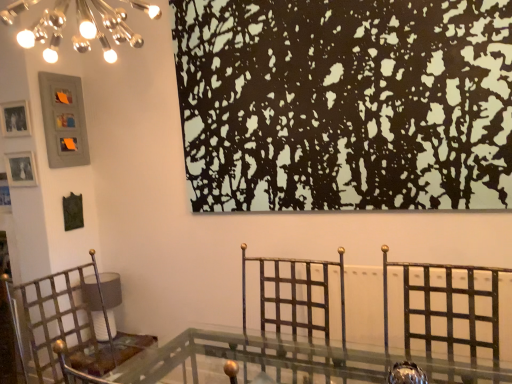
In order to face matte silver picture frame at upper left, the 2th picture frame positioned from the top, should I rotate leftwards or rightwards?

You should look left and rotate roughly 29.496 degrees.

The image size is (512, 384). Describe the element at coordinates (345, 104) in the screenshot. I see `black matte painting at upper center` at that location.

The height and width of the screenshot is (384, 512). Find the location of `metallic gold swivel chair at center`. metallic gold swivel chair at center is located at coordinates (295, 293).

The height and width of the screenshot is (384, 512). I want to click on matte silver picture frame at upper left, the 2th picture frame positioned from the top, so click(x=15, y=119).

I want to click on the 1st picture frame positioned above the matte silver picture frame at left, the third picture frame in the top-to-bottom sequence (from a real-world perspective), so click(64, 120).

Is the position of matte gray picture frame at upper left, marked as the first picture frame in a top-to-bottom arrangement, less distant than that of matte silver picture frame at left, the third picture frame in the top-to-bottom sequence?

No, matte gray picture frame at upper left, marked as the first picture frame in a top-to-bottom arrangement, is further to the viewer.

Between matte gray picture frame at upper left, the 3th picture frame in the bottom-to-top sequence, and matte silver picture frame at left, the 1th picture frame ordered from the bottom, which one appears on the right side from the viewer's perspective?

From the viewer's perspective, matte gray picture frame at upper left, the 3th picture frame in the bottom-to-top sequence, appears more on the right side.

Is matte silver picture frame at upper left, the 2th picture frame positioned from the top, a part of metallic gold swivel chair at center?

Definitely not — matte silver picture frame at upper left, the 2th picture frame positioned from the top, is not inside metallic gold swivel chair at center.

Is metallic gold swivel chair at center touching matte silver picture frame at upper left, which ranks as the second picture frame in bottom-to-top order?

No.

Does point (320, 304) come behind point (8, 113)?

That is False.

Is metallic gold swivel chair at center with black matte painting at upper center?

There is a gap between metallic gold swivel chair at center and black matte painting at upper center.

Is metallic gold swivel chair at center facing away from black matte painting at upper center?

No, metallic gold swivel chair at center is not facing away from black matte painting at upper center.

From their relative heights in the image, would you say metallic gold swivel chair at center is taller or shorter than black matte painting at upper center?

Clearly, metallic gold swivel chair at center is shorter compared to black matte painting at upper center.

How much distance is there between metallic gold swivel chair at center and black matte painting at upper center?

A distance of 30.63 inches exists between metallic gold swivel chair at center and black matte painting at upper center.

Is point (208, 14) in front of point (327, 342)?

No, (208, 14) is further to viewer.

Locate an element on the screen. This screenshot has height=384, width=512. tree above the metallic gold swivel chair at center (from a real-world perspective) is located at coordinates (345, 104).

From the picture: Which object is closer to the camera taking this photo, black matte painting at upper center or metallic gold swivel chair at center?

Positioned in front is metallic gold swivel chair at center.

From a real-world perspective, which is physically above, matte gray picture frame at upper left, the 3th picture frame in the bottom-to-top sequence, or metallic/golden chair at left?

From a 3D spatial view, matte gray picture frame at upper left, the 3th picture frame in the bottom-to-top sequence, is above.

Which is in front, point (80, 104) or point (93, 337)?

Point (93, 337)

From the picture: From the image's perspective, which one is positioned lower, matte gray picture frame at upper left, the 3th picture frame in the bottom-to-top sequence, or metallic/golden chair at left?

metallic/golden chair at left appears lower in the image.

How many degrees apart are the facing directions of matte gray picture frame at upper left, the 3th picture frame in the bottom-to-top sequence, and metallic/golden chair at left?

The facing directions of matte gray picture frame at upper left, the 3th picture frame in the bottom-to-top sequence, and metallic/golden chair at left are 96.3 degrees apart.

Consider the image. Is the surface of matte silver picture frame at upper left, the 2th picture frame positioned from the top, in direct contact with black matte painting at upper center?

No.

Considering the sizes of matte silver picture frame at upper left, which ranks as the second picture frame in bottom-to-top order, and black matte painting at upper center in the image, is matte silver picture frame at upper left, which ranks as the second picture frame in bottom-to-top order, wider or thinner than black matte painting at upper center?

In the image, matte silver picture frame at upper left, which ranks as the second picture frame in bottom-to-top order, appears to be more narrow than black matte painting at upper center.

Relative to black matte painting at upper center, is matte silver picture frame at upper left, which ranks as the second picture frame in bottom-to-top order, in front or behind?

matte silver picture frame at upper left, which ranks as the second picture frame in bottom-to-top order, is positioned farther from the viewer than black matte painting at upper center.

Measure the distance from black matte painting at upper center to matte silver picture frame at upper left, which ranks as the second picture frame in bottom-to-top order.

5.74 feet.

In the image, is black matte painting at upper center positioned in front of or behind matte silver picture frame at upper left, the 2th picture frame positioned from the top?

black matte painting at upper center is positioned closer to the viewer than matte silver picture frame at upper left, the 2th picture frame positioned from the top.

Does point (368, 52) appear closer or farther from the camera than point (16, 101)?

Point (368, 52) is closer to the camera than point (16, 101).

Between black matte painting at upper center and matte silver picture frame at upper left, which ranks as the second picture frame in bottom-to-top order, which one appears on the left side from the viewer's perspective?

matte silver picture frame at upper left, which ranks as the second picture frame in bottom-to-top order, is more to the left.

Where is `the 1st picture frame directly above the matte silver picture frame at left, the 1th picture frame ordered from the bottom (from a real-world perspective)`? The image size is (512, 384). the 1st picture frame directly above the matte silver picture frame at left, the 1th picture frame ordered from the bottom (from a real-world perspective) is located at coordinates (64, 120).

You are a GUI agent. You are given a task and a screenshot of the screen. Output one action in this format:
    pyautogui.click(x=<x>, y=<y>)
    Task: Click on the picture frame that is the 1st one when counting backward from the metallic gold swivel chair at center
    The width and height of the screenshot is (512, 384).
    Given the screenshot: What is the action you would take?
    pos(15,119)

Estimate the real-world distances between objects in this image. Which object is further from black matte painting at upper center, metallic/golden chair at left or metallic gold swivel chair at center?

metallic/golden chair at left is positioned further to the anchor black matte painting at upper center.

When comparing their distances from matte silver picture frame at upper left, the 2th picture frame positioned from the top, does metallic gold swivel chair at center or metallic/golden chair at left seem closer?

metallic/golden chair at left lies closer to matte silver picture frame at upper left, the 2th picture frame positioned from the top, than the other object.

Which object lies nearer to the anchor point matte silver picture frame at upper left, the 2th picture frame positioned from the top, matte silver picture frame at left, the 1th picture frame ordered from the bottom, or black matte painting at upper center?

Based on the image, matte silver picture frame at left, the 1th picture frame ordered from the bottom, appears to be nearer to matte silver picture frame at upper left, the 2th picture frame positioned from the top.

Based on their spatial positions, is black matte painting at upper center or matte silver picture frame at left, the 1th picture frame ordered from the bottom, closer to metallic gold swivel chair at center?

Based on the image, black matte painting at upper center appears to be nearer to metallic gold swivel chair at center.

Which object lies nearer to the anchor point black matte painting at upper center, metallic/golden chair at left or matte gray picture frame at upper left, marked as the first picture frame in a top-to-bottom arrangement?

metallic/golden chair at left lies closer to black matte painting at upper center than the other object.

When comparing their distances from matte gray picture frame at upper left, the 3th picture frame in the bottom-to-top sequence, does matte silver picture frame at upper left, the 2th picture frame positioned from the top, or black matte painting at upper center seem closer?

Based on the image, matte silver picture frame at upper left, the 2th picture frame positioned from the top, appears to be nearer to matte gray picture frame at upper left, the 3th picture frame in the bottom-to-top sequence.

When comparing their distances from metallic/golden chair at left, does metallic gold swivel chair at center or black matte painting at upper center seem closer?

The object closer to metallic/golden chair at left is metallic gold swivel chair at center.

Which object lies further to the anchor point matte gray picture frame at upper left, marked as the first picture frame in a top-to-bottom arrangement, matte silver picture frame at left, the 1th picture frame ordered from the bottom, or metallic gold swivel chair at center?

metallic gold swivel chair at center.

The height and width of the screenshot is (384, 512). I want to click on furniture situated between matte gray picture frame at upper left, the 3th picture frame in the bottom-to-top sequence, and black matte painting at upper center from left to right, so click(x=66, y=329).

This screenshot has height=384, width=512. Find the location of `furniture situated between matte silver picture frame at upper left, which ranks as the second picture frame in bottom-to-top order, and metallic gold swivel chair at center from left to right`. furniture situated between matte silver picture frame at upper left, which ranks as the second picture frame in bottom-to-top order, and metallic gold swivel chair at center from left to right is located at coordinates (66, 329).

You are a GUI agent. You are given a task and a screenshot of the screen. Output one action in this format:
    pyautogui.click(x=<x>, y=<y>)
    Task: Click on the furniture between metallic gold swivel chair at center and matte gray picture frame at upper left, marked as the first picture frame in a top-to-bottom arrangement, along the z-axis
    The image size is (512, 384).
    Given the screenshot: What is the action you would take?
    pyautogui.click(x=66, y=329)

Image resolution: width=512 pixels, height=384 pixels. Find the location of `swivel chair that lies between black matte painting at upper center and metallic/golden chair at left from top to bottom`. swivel chair that lies between black matte painting at upper center and metallic/golden chair at left from top to bottom is located at coordinates (295, 293).